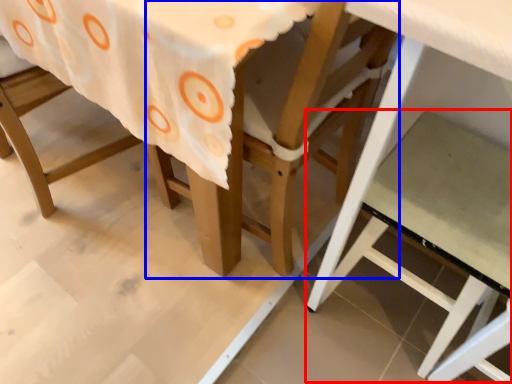
Question: Among these objects, which one is farthest to the camera, step stool (highlighted by a red box) or chair (highlighted by a blue box)?

Choices:
 (A) step stool
 (B) chair

Answer: (A)